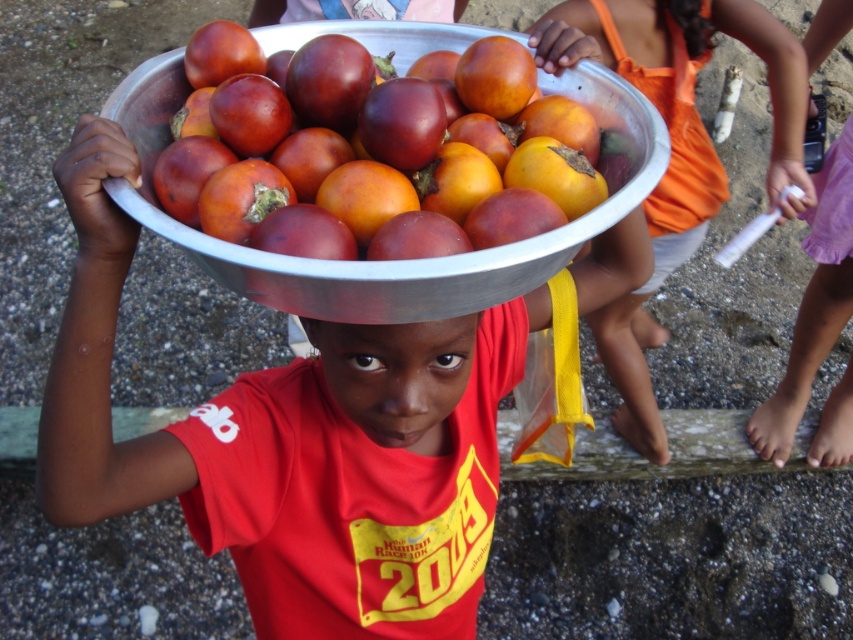
Question: Which object appears farthest from the camera in this image?

Choices:
 (A) shiny metallic bowl at center
 (B) matte metallic bowl at center
 (C) matte orange bowl at center

Answer: (C)

Question: Can you confirm if matte metallic bowl at center is smaller than shiny metallic bowl at center?

Choices:
 (A) yes
 (B) no

Answer: (B)

Question: Which is nearer to the shiny metallic bowl at center?

Choices:
 (A) matte orange bowl at center
 (B) matte metallic bowl at center

Answer: (B)

Question: Can you confirm if matte metallic bowl at center is positioned below matte orange bowl at center?

Choices:
 (A) yes
 (B) no

Answer: (A)

Question: Is matte metallic bowl at center smaller than matte orange bowl at center?

Choices:
 (A) yes
 (B) no

Answer: (A)

Question: Which object is closer to the camera taking this photo?

Choices:
 (A) matte metallic bowl at center
 (B) matte orange bowl at center
 (C) shiny metallic bowl at center

Answer: (C)